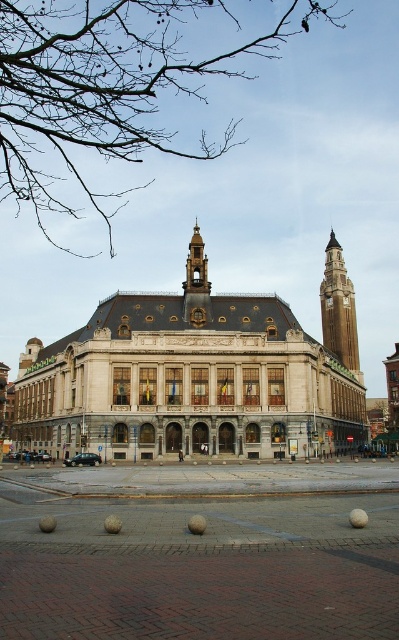
Which of these two, brick paving at center or beige stone building at center, stands taller?

beige stone building at center

Is brick paving at center positioned before beige stone building at center?

Result: Yes, it is in front of beige stone building at center.

Where is `brick paving at center`? brick paving at center is located at coordinates (201, 552).

Can you confirm if beige stone building at center is positioned to the right of brown stone clock tower at upper right?

Incorrect, beige stone building at center is not on the right side of brown stone clock tower at upper right.

Is point (126, 445) closer to camera compared to point (337, 307)?

Yes, point (126, 445) is closer to viewer.

I want to click on beige stone building at center, so click(197, 374).

Does brick paving at center appear over brown stone clock tower at upper right?

Actually, brick paving at center is below brown stone clock tower at upper right.

Is point (17, 628) positioned in front of point (329, 250)?

Yes.

The height and width of the screenshot is (640, 399). What are the coordinates of `brick paving at center` in the screenshot? It's located at (201, 552).